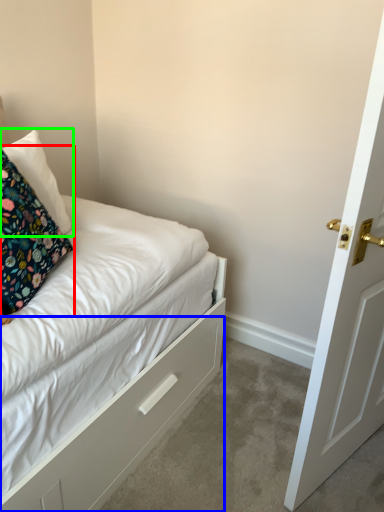
Question: Which object is the farthest from pillow (highlighted by a red box)? Choose among these: drawer (highlighted by a blue box) or pillow (highlighted by a green box).

Choices:
 (A) drawer
 (B) pillow

Answer: (A)